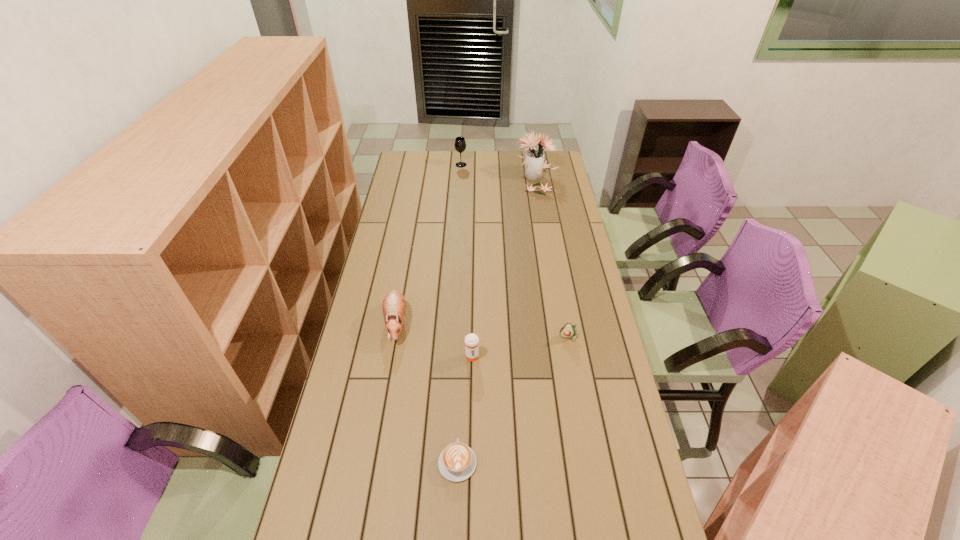
Where is `object at the far right corner`? This screenshot has width=960, height=540. object at the far right corner is located at coordinates (534, 163).

You are a GUI agent. You are given a task and a screenshot of the screen. Output one action in this format:
    pyautogui.click(x=<x>, y=<y>)
    Task: Click on the free space at the far edge of the desktop
    
    Given the screenshot: What is the action you would take?
    pyautogui.click(x=458, y=154)

Identify the location of vacant space at the left edge of the desktop. The width and height of the screenshot is (960, 540). (421, 193).

Locate an element on the screen. Image resolution: width=960 pixels, height=540 pixels. free space at the right edge of the desktop is located at coordinates (555, 235).

In the image, there is a desktop. Identify the location of free space at the far right corner. (554, 154).

You are a GUI agent. You are given a task and a screenshot of the screen. Output one action in this format:
    pyautogui.click(x=<x>, y=<y>)
    Task: Click on the blank region between the fifth tallest object and the leftmost object
    This screenshot has height=540, width=960.
    Given the screenshot: What is the action you would take?
    pyautogui.click(x=483, y=330)

The width and height of the screenshot is (960, 540). In order to click on free space between the shortest object and the hamster in this screenshot , I will do `click(427, 392)`.

Locate an element on the screen. The image size is (960, 540). vacant space in between the bouquet and the nearest object is located at coordinates (496, 320).

Locate an element on the screen. The image size is (960, 540). vacant space that is in between the tallest object and the fifth farthest object is located at coordinates (503, 267).

Where is `empty location between the bouquet and the hamster`? This screenshot has height=540, width=960. empty location between the bouquet and the hamster is located at coordinates (466, 250).